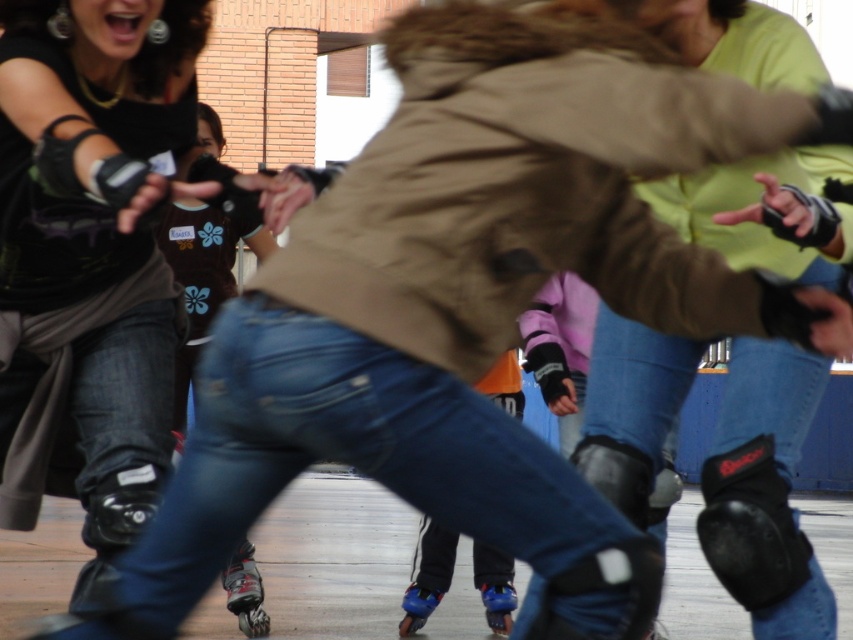
Question: Which point is farther to the camera?

Choices:
 (A) matte black knee pads at lower left
 (B) shiny black roller skate at lower center

Answer: (B)

Question: Is shiny black roller skate at lower center wider than blue matte roller skate at lower center?

Choices:
 (A) yes
 (B) no

Answer: (A)

Question: Which object is the closest to the shiny black roller skate at lower center?

Choices:
 (A) blue plastic roller skate at lower center
 (B) black matte knee pad at lower right
 (C) blue matte roller skate at lower center

Answer: (C)

Question: Among these points, which one is farthest from the camera?

Choices:
 (A) (247, 573)
 (B) (758, 472)
 (C) (129, 106)

Answer: (A)

Question: Is blue plastic roller skate at lower center positioned behind blue matte roller skate at lower center?

Choices:
 (A) yes
 (B) no

Answer: (B)

Question: Can you confirm if shiny black roller skate at lower center is smaller than blue plastic roller skate at lower center?

Choices:
 (A) no
 (B) yes

Answer: (A)